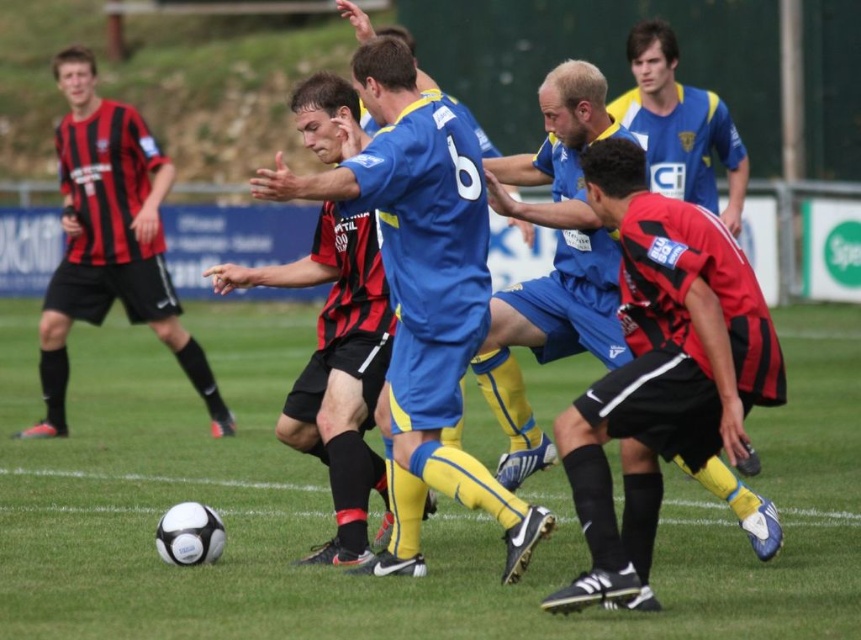
Question: Which object is positioned closest to the blue matte jersey at center?

Choices:
 (A) red and black jersey at center
 (B) black jersey at left
 (C) white matte soccer ball at center

Answer: (A)

Question: Can you confirm if white matte soccer ball at center is wider than black jersey at left?

Choices:
 (A) yes
 (B) no

Answer: (A)

Question: Does red and black jersey at center appear on the left side of blue matte jersey at center?

Choices:
 (A) no
 (B) yes

Answer: (A)

Question: Does red and black jersey at center appear on the right side of black jersey at left?

Choices:
 (A) yes
 (B) no

Answer: (A)

Question: Which object appears farthest from the camera in this image?

Choices:
 (A) blue jersey at center
 (B) blue matte jersey at center
 (C) white matte soccer ball at center
 (D) black jersey at left

Answer: (D)

Question: Which object is the closest to the blue jersey at center?

Choices:
 (A) blue matte jersey at center
 (B) white matte soccer ball at center

Answer: (A)